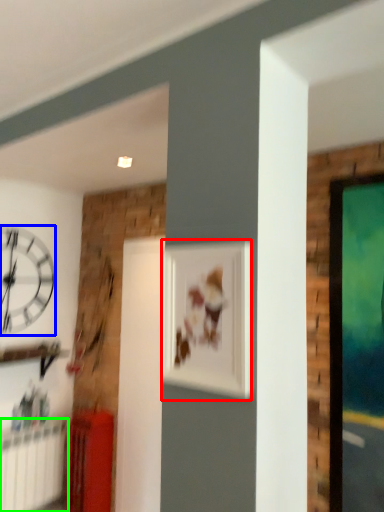
Question: Estimate the real-world distances between objects in this image. Which object is farther from picture frame (highlighted by a red box), wall clock (highlighted by a blue box) or radiator (highlighted by a green box)?

Choices:
 (A) wall clock
 (B) radiator

Answer: (B)